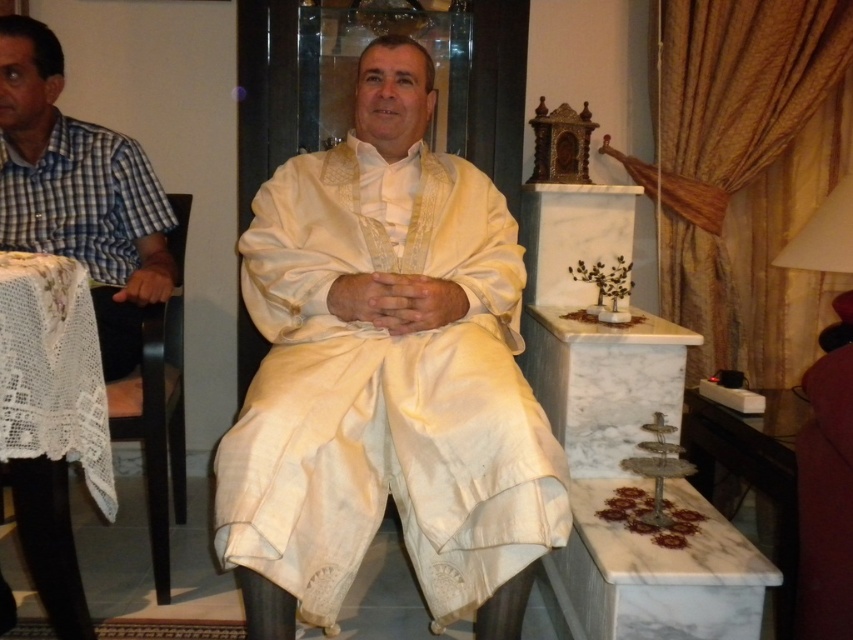
You are a photographer trying to capture a closeup of the white silk robe at center without including the black wood chair at left in the frame. Given their current distance, can you do this?

The white silk robe at center and black wood chair at left are 22.67 inches apart. Since the distance is sufficient to frame the robe separately, you can position the camera to capture the white silk robe at center without including the black wood chair at left.

You are a photographer setting up for a portrait. You need to ensure that the white silk robe at center is visible above the black wood chair at left in the final shot. Based on the scene description, is this arrangement already achievable?

The white silk robe at center is already positioned above the black wood chair at left, so the arrangement is achievable without adjustments.

You are planning to move the black wood chair at left to the right side of the room. Considering the size of the crocheted lace tablecloth at left, will the chair fit on it after moving?

The black wood chair at left is larger in size than the crocheted lace tablecloth at left. Therefore, moving the chair to the right side of the room would not allow it to fit on the tablecloth since it is bigger.